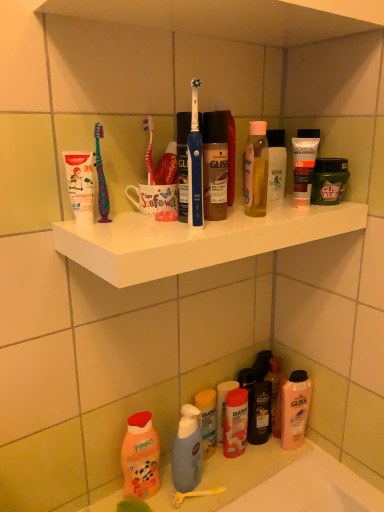
The width and height of the screenshot is (384, 512). I want to click on vacant area that lies between blue plastic toothbrush at center and white matte toothpaste tube at upper left, the 6th toiletry from the right, so click(x=138, y=226).